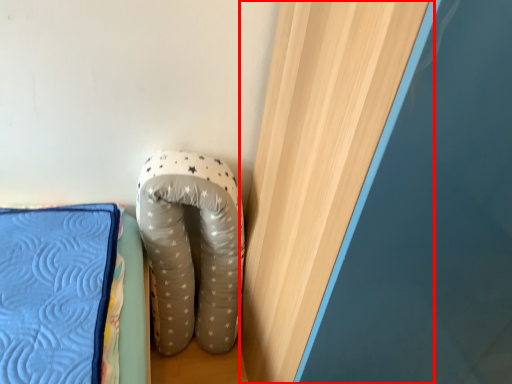
Question: In this image, where is curtain (annotated by the red box) located relative to footwear?

Choices:
 (A) left
 (B) right

Answer: (B)